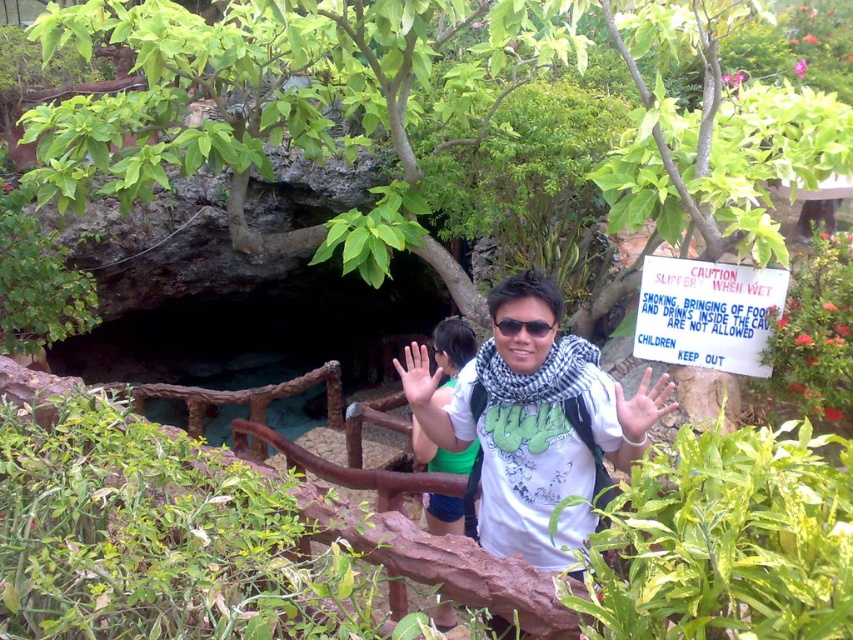
You are a photographer trying to capture a clear image of the white cotton shirt at center and the smooth skin hand at center. The camera you are using has a minimum focus distance of 1 meter. Can you focus on both objects simultaneously without moving the camera?

The distance between the white cotton shirt at center and the smooth skin hand at center is 87.92 centimeters, which is less than the camera minimum focus distance of 1 meter. Therefore, the camera cannot focus on both objects simultaneously without moving the camera.

You are standing at the cave entrance and see two points marked in the image. Which point is closer to you, point (x=572, y=534) or point (x=427, y=380)?

Point (x=572, y=534) is in front of point (x=427, y=380), so it is closer to you.

You are a hiker who just arrived at the cave entrance. You want to read the white paper sign at center right but are unsure if you can reach it without moving closer. If your arms can extend 1.5 meters, can you touch the sign?

The white paper sign at center right is 3.93 meters away from you, which is farther than your 1.5 meter arm extension range. You cannot reach it without moving closer.